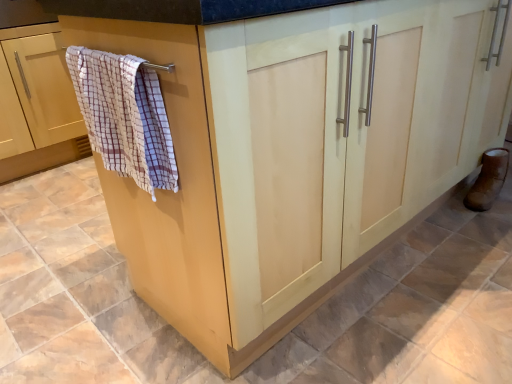
Where is `brown leather boot at lower right`? brown leather boot at lower right is located at coordinates (488, 180).

Which is nearer, (496, 190) or (66, 94)?

Point (496, 190) is positioned closer to the camera compared to point (66, 94).

You are a GUI agent. You are given a task and a screenshot of the screen. Output one action in this format:
    pyautogui.click(x=<x>, y=<y>)
    Task: Click on the cabinetry above the brown leather boot at lower right (from a real-world perspective)
    This screenshot has height=384, width=512.
    Given the screenshot: What is the action you would take?
    pyautogui.click(x=42, y=102)

How distant is brown leather boot at lower right from beige wood towel rack at left?

brown leather boot at lower right is 2.09 meters away from beige wood towel rack at left.

From the image's perspective, which is above, brown leather boot at lower right or beige wood towel rack at left?

beige wood towel rack at left is shown above in the image.

Does beige wood towel rack at left appear on the left side of brown leather boot at lower right?

Indeed, beige wood towel rack at left is positioned on the left side of brown leather boot at lower right.

Is beige wood towel rack at left facing towards brown leather boot at lower right?

No.

From the image's perspective, between beige wood towel rack at left and brown leather boot at lower right, which one is located above?

From the image's view, beige wood towel rack at left is above.

Find the location of a particular element. cabinetry that is above the brown leather boot at lower right (from a real-world perspective) is located at coordinates (42, 102).

Is checkered fabric bath towel at left positioned in front of brown leather boot at lower right?

Yes, checkered fabric bath towel at left is in front of brown leather boot at lower right.

In the scene shown: Is checkered fabric bath towel at left positioned with its back to brown leather boot at lower right?

checkered fabric bath towel at left is not turned away from brown leather boot at lower right.

Between checkered fabric bath towel at left and brown leather boot at lower right, which one has smaller width?

brown leather boot at lower right is thinner.

Is checkered fabric bath towel at left located outside brown leather boot at lower right?

checkered fabric bath towel at left lies outside brown leather boot at lower right's area.

Which object is thinner, beige wood towel rack at left or checkered fabric bath towel at left?

Thinner between the two is checkered fabric bath towel at left.

What's the angular difference between beige wood towel rack at left and checkered fabric bath towel at left's facing directions?

The angle between the facing direction of beige wood towel rack at left and the facing direction of checkered fabric bath towel at left is 2.67 degrees.

From a real-world perspective, is beige wood towel rack at left positioned under checkered fabric bath towel at left based on gravity?

Yes, from a real-world perspective, beige wood towel rack at left is under checkered fabric bath towel at left.

Relative to checkered fabric bath towel at left, is beige wood towel rack at left in front or behind?

Visually, beige wood towel rack at left is located behind checkered fabric bath towel at left.

Could you tell me if checkered fabric bath towel at left is facing beige wood towel rack at left?

No, checkered fabric bath towel at left is not turned towards beige wood towel rack at left.

From a real-world perspective, which object rests below the other?

From a 3D spatial view, beige wood towel rack at left is below.

Are checkered fabric bath towel at left and beige wood towel rack at left beside each other?

There is a gap between checkered fabric bath towel at left and beige wood towel rack at left.

From the image's perspective, between checkered fabric bath towel at left and beige wood towel rack at left, who is located below?

checkered fabric bath towel at left, from the image's perspective.

Which is in front, brown leather boot at lower right or checkered fabric bath towel at left?

checkered fabric bath towel at left is more forward.

Is brown leather boot at lower right shorter than checkered fabric bath towel at left?

Correct, brown leather boot at lower right is not as tall as checkered fabric bath towel at left.

Can you confirm if brown leather boot at lower right is smaller than checkered fabric bath towel at left?

Yes.

Locate an element on the screen. cabinetry that is behind the brown leather boot at lower right is located at coordinates (42, 102).

Locate an element on the screen. The width and height of the screenshot is (512, 384). footwear located in front of the beige wood towel rack at left is located at coordinates (488, 180).

Based on the photo, looking at the image, which one is located further to brown leather boot at lower right, beige wood towel rack at left or checkered fabric bath towel at left?

Based on the image, beige wood towel rack at left appears to be further to brown leather boot at lower right.

Considering their positions, is beige wood towel rack at left positioned closer to checkered fabric bath towel at left than brown leather boot at lower right?

The object closer to checkered fabric bath towel at left is brown leather boot at lower right.

Which object lies nearer to the anchor point checkered fabric bath towel at left, brown leather boot at lower right or beige wood towel rack at left?

brown leather boot at lower right is closer to checkered fabric bath towel at left.

Considering their positions, is brown leather boot at lower right positioned further to beige wood towel rack at left than checkered fabric bath towel at left?

The object further to beige wood towel rack at left is brown leather boot at lower right.

Consider the image. From the image, which object appears to be farther from brown leather boot at lower right, checkered fabric bath towel at left or beige wood towel rack at left?

Among the two, beige wood towel rack at left is located further to brown leather boot at lower right.

From the image, which object appears to be nearer to beige wood towel rack at left, checkered fabric bath towel at left or brown leather boot at lower right?

checkered fabric bath towel at left is closer to beige wood towel rack at left.

Find the location of a particular element. This screenshot has width=512, height=384. bath towel located between beige wood towel rack at left and brown leather boot at lower right in the left-right direction is located at coordinates (125, 116).